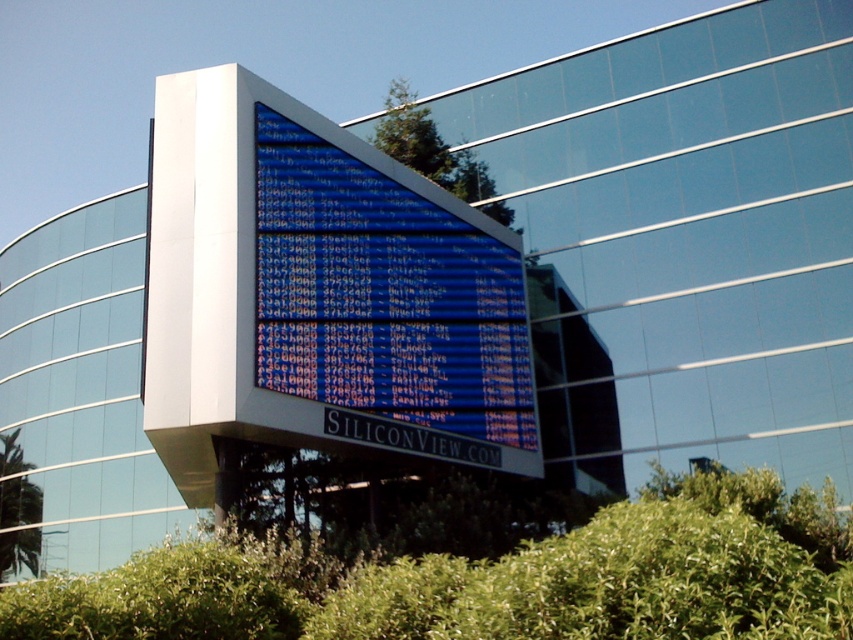
You are standing in front of the modern building and want to take a photo that includes both the green leafy tree at upper center and the green leafy tree at lower left. Which tree should you focus on first to ensure both are in the frame?

You should focus on the green leafy tree at lower left first because the green leafy tree at upper center is positioned over it, so adjusting the camera angle to include the lower one will naturally capture the upper one as well.

You are standing in front of the modern building with the digital display screen. There are two points marked on the screen at coordinates point (509, 221) and point (4, 472). If you want to touch the point that is closer to you, which coordinate should you aim for?

Point (509, 221) is closer to the viewer than point (4, 472), so you should aim for point (509, 221).